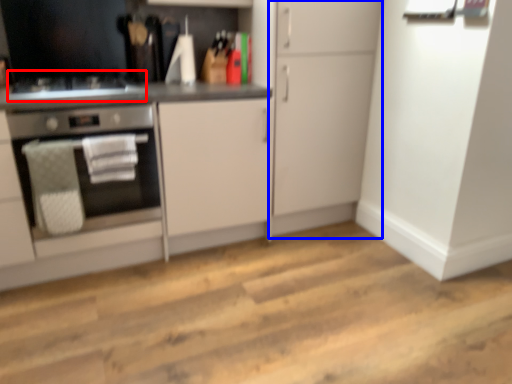
Question: Which of the following is the farthest to the observer, gas stove (highlighted by a red box) or cabinetry (highlighted by a blue box)?

Choices:
 (A) gas stove
 (B) cabinetry

Answer: (B)